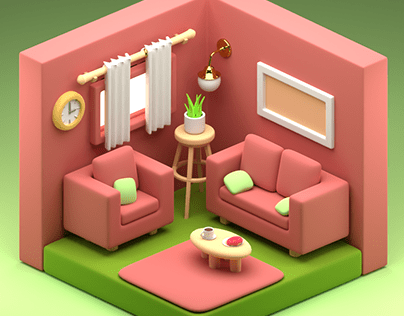
At what (x,y) coordinates should I click in order to perform the action: click on light fixture. Please return your answer as a coordinate pair (x, y). Looking at the image, I should click on (224, 45).